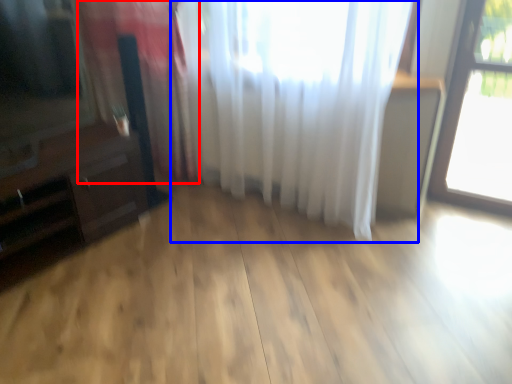
Question: Among these objects, which one is nearest to the camera, curtain (highlighted by a red box) or curtain (highlighted by a blue box)?

Choices:
 (A) curtain
 (B) curtain

Answer: (B)